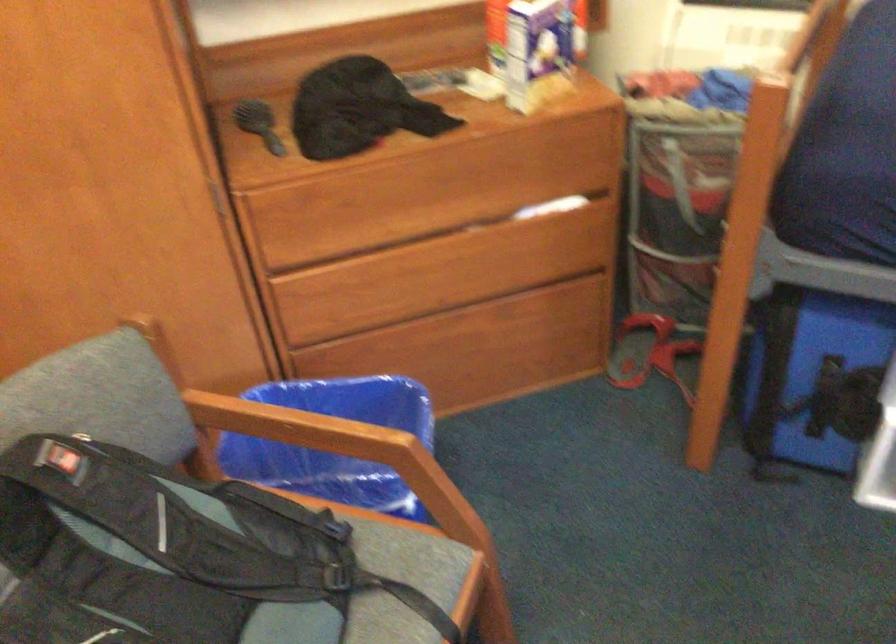
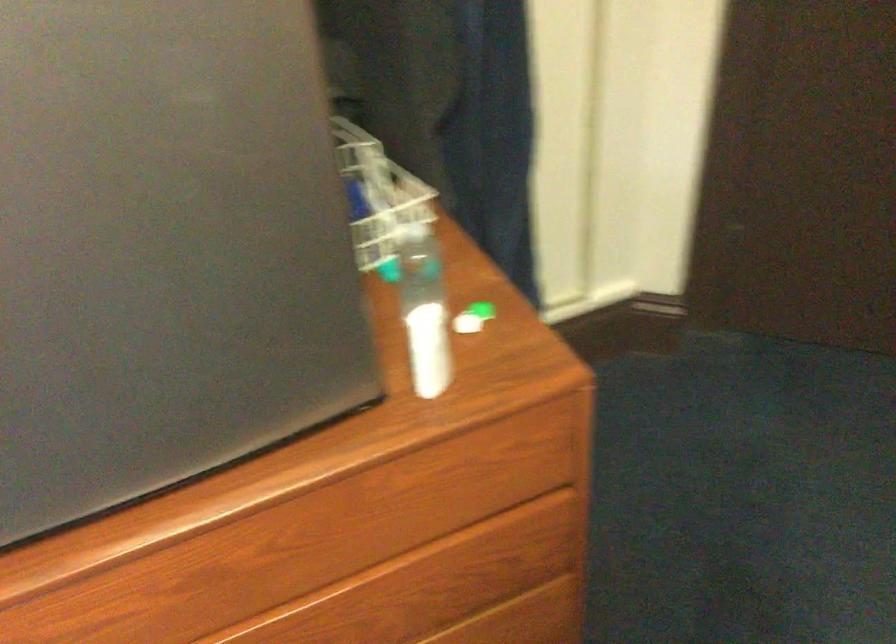
How did the camera likely rotate?

The rotation direction of the camera is left-down.